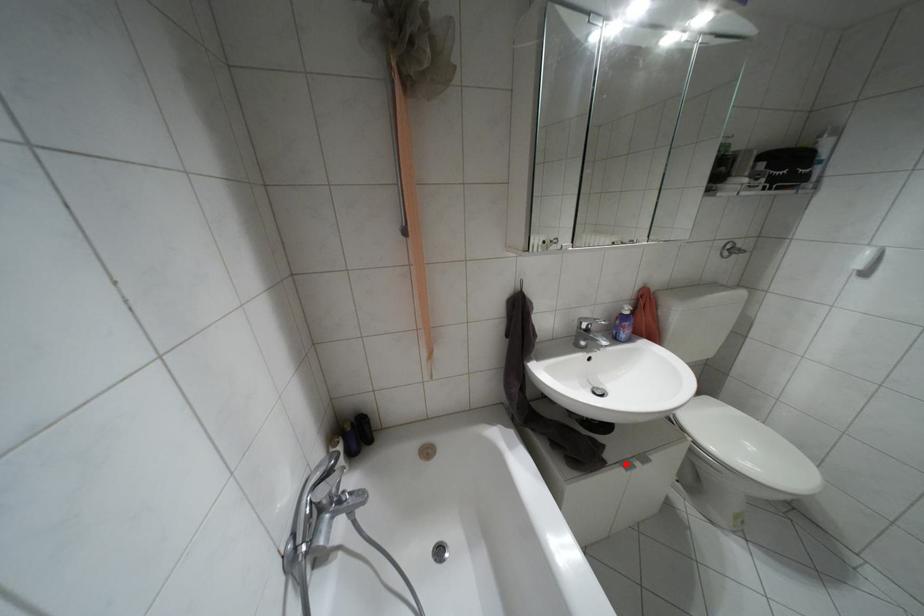
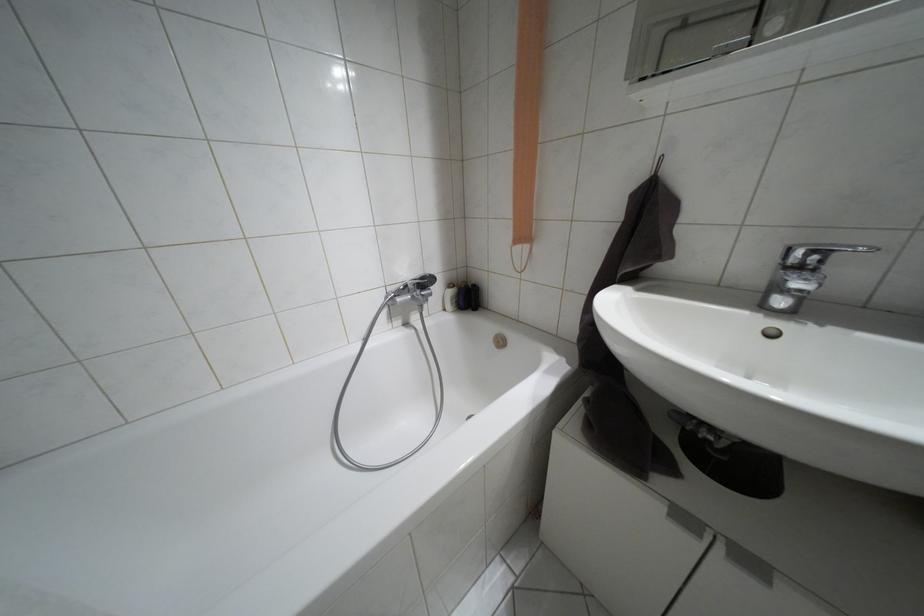
In the second image, find the point that corresponds to the highlighted location in the first image.

(684, 517)